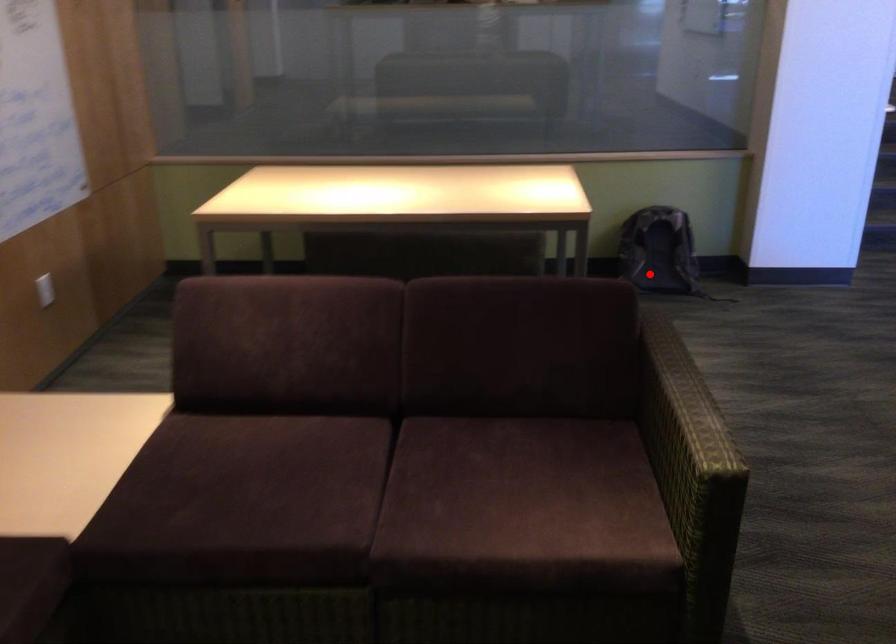
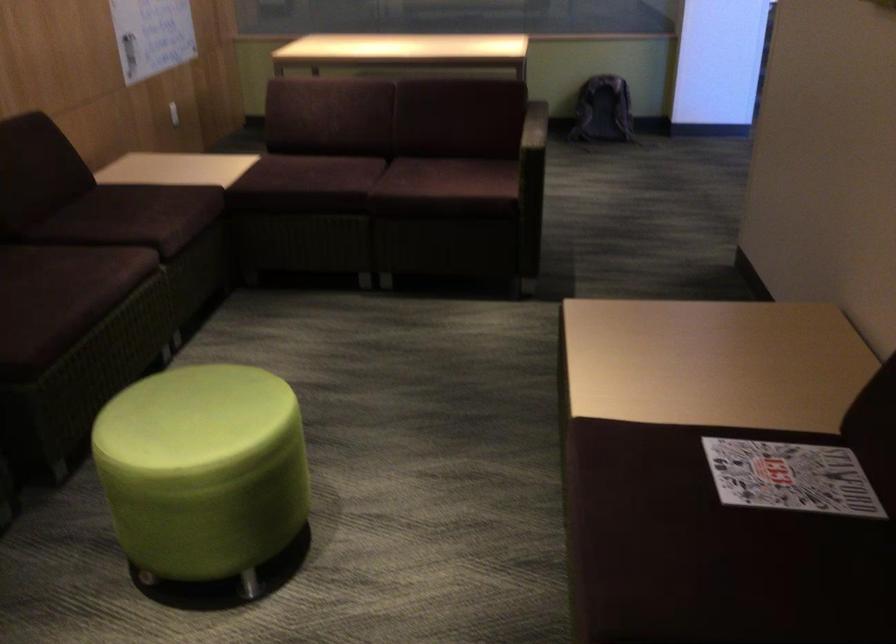
The point at the highlighted location is marked in the first image. Where is the corresponding point in the second image?

(602, 109)